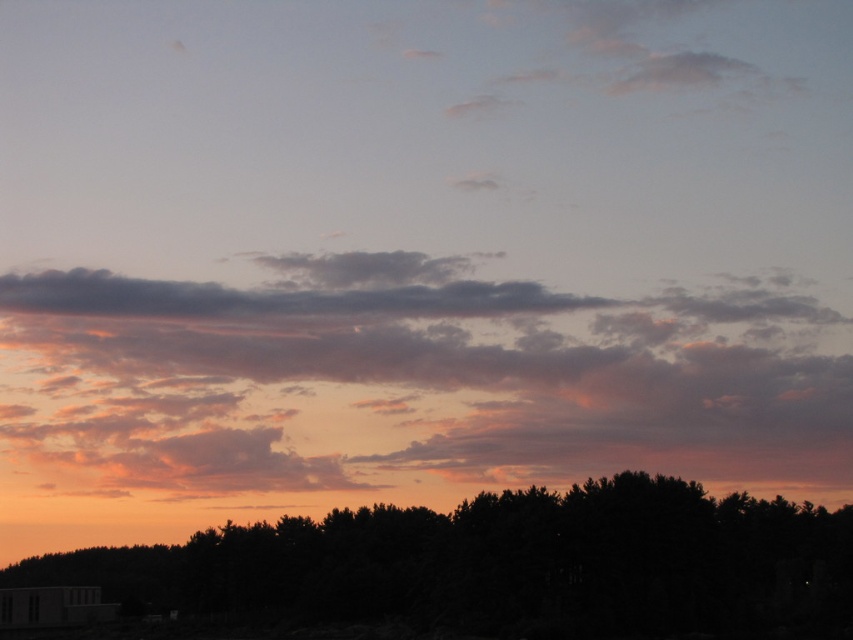
What do you see at coordinates (413, 380) in the screenshot?
I see `cloudy sky at upper center` at bounding box center [413, 380].

Does cloudy sky at upper center have a greater width compared to silhouette tree at lower center?

Correct, the width of cloudy sky at upper center exceeds that of silhouette tree at lower center.

Between point (554, 332) and point (704, 509), which one is positioned in front?

Positioned in front is point (704, 509).

Where is `cloudy sky at upper center`? cloudy sky at upper center is located at coordinates (413, 380).